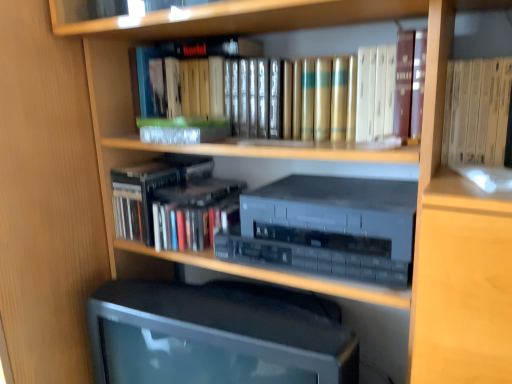
Question: Can you confirm if gold leather book at center, positioned as the second book in bottom-to-top order, is bigger than matte black monitor at center?

Choices:
 (A) no
 (B) yes

Answer: (A)

Question: Is matte black monitor at center surrounded by gold leather book at center, positioned as the second book in bottom-to-top order?

Choices:
 (A) no
 (B) yes

Answer: (A)

Question: Is gold leather book at center, positioned as the second book in bottom-to-top order, wider than matte black monitor at center?

Choices:
 (A) no
 (B) yes

Answer: (A)

Question: Does gold leather book at center, positioned as the second book in bottom-to-top order, appear on the right side of matte black monitor at center?

Choices:
 (A) yes
 (B) no

Answer: (A)

Question: Is there a large distance between gold leather book at center, the first book viewed from the top, and matte black monitor at center?

Choices:
 (A) yes
 (B) no

Answer: (B)

Question: Is gold leather book at center, the first book viewed from the top, to the left or to the right of hardcover books at center, which appears as the first book when ordered from the bottom, in the image?

Choices:
 (A) right
 (B) left

Answer: (A)

Question: Is gold leather book at center, positioned as the second book in bottom-to-top order, wider or thinner than hardcover books at center, which ranks as the second book in top-to-bottom order?

Choices:
 (A) thin
 (B) wide

Answer: (A)

Question: From the image's perspective, relative to hardcover books at center, which appears as the first book when ordered from the bottom, is gold leather book at center, the first book viewed from the top, above or below?

Choices:
 (A) below
 (B) above

Answer: (B)

Question: Considering the positions of gold leather book at center, the first book viewed from the top, and hardcover books at center, which appears as the first book when ordered from the bottom, in the image, is gold leather book at center, the first book viewed from the top, taller or shorter than hardcover books at center, which appears as the first book when ordered from the bottom,?

Choices:
 (A) tall
 (B) short

Answer: (A)

Question: Considering the positions of point (192, 309) and point (265, 261), is point (192, 309) closer or farther from the camera than point (265, 261)?

Choices:
 (A) closer
 (B) farther

Answer: (A)

Question: Is matte black monitor at center taller or shorter than satin silver stereo at center?

Choices:
 (A) tall
 (B) short

Answer: (A)

Question: In the image, is matte black monitor at center on the left side or the right side of satin silver stereo at center?

Choices:
 (A) right
 (B) left

Answer: (B)

Question: From the image's perspective, is matte black monitor at center located above or below satin silver stereo at center?

Choices:
 (A) below
 (B) above

Answer: (A)

Question: Considering the positions of hardcover books at center, which appears as the first book when ordered from the bottom, and matte black monitor at center in the image, is hardcover books at center, which appears as the first book when ordered from the bottom, bigger or smaller than matte black monitor at center?

Choices:
 (A) big
 (B) small

Answer: (B)

Question: From the image's perspective, is hardcover books at center, which appears as the first book when ordered from the bottom, positioned above or below matte black monitor at center?

Choices:
 (A) above
 (B) below

Answer: (A)